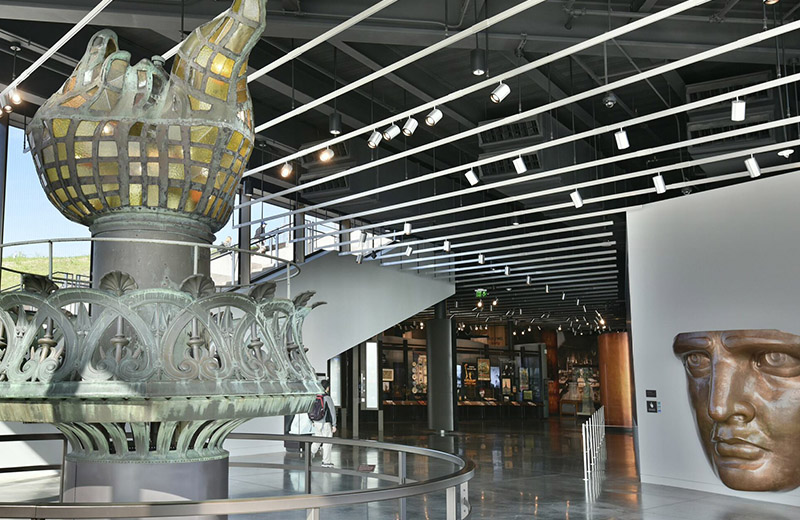
Where is `pillar`? This screenshot has width=800, height=520. pillar is located at coordinates (438, 401).